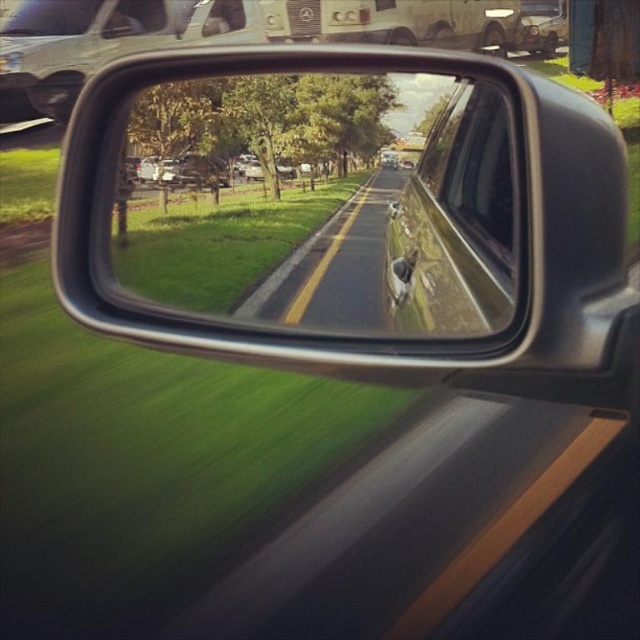
In the scene shown: You are a driver adjusting your seat to ensure you can see clearly through the glossy metallic mirror at center. The recommended distance between your eyes and the mirror is 38 inches. Based on the scene, is the current distance appropriate?

The glossy metallic mirror at center is 38.26 inches away from the viewer, which is slightly more than the recommended 38 inches. This distance is still appropriate as it allows for a clear view.

You are driving a car and notice the glossy metallic mirror at center and the glossy reflective road at center in your side mirror. Which object appears taller in the reflection?

The glossy metallic mirror at center appears taller than the glossy reflective road at center in the reflection.

You are driving and want to check your surroundings using the glossy metallic mirror at center and the glossy reflective road at center. Which object is positioned to the right of the other?

The glossy metallic mirror at center is to the right of the glossy reflective road at center according to the description.